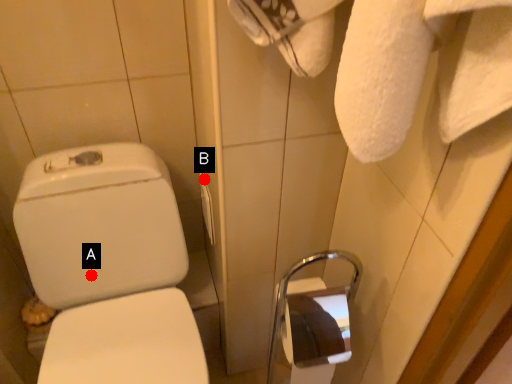
Question: Two points are circled on the image, labeled by A and B beside each circle. Which point appears closest to the camera in this image?

Choices:
 (A) A is closer
 (B) B is closer

Answer: (B)